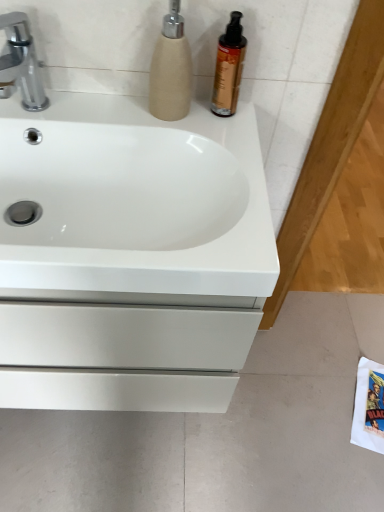
Find the location of a particular element. The width and height of the screenshot is (384, 512). shiny amber bottle at upper right is located at coordinates (229, 68).

Where is `silver metallic faucet at upper left`? This screenshot has height=512, width=384. silver metallic faucet at upper left is located at coordinates (21, 63).

Considering the sizes of objects shiny amber bottle at upper right and beige textured soap dispenser at upper center in the image provided, who is taller, shiny amber bottle at upper right or beige textured soap dispenser at upper center?

beige textured soap dispenser at upper center.

Based on the photo, from a real-world perspective, which is physically below, shiny amber bottle at upper right or beige textured soap dispenser at upper center?

shiny amber bottle at upper right, from a real-world perspective.

Identify the location of soap dispenser above the shiny amber bottle at upper right (from the image's perspective). The image size is (384, 512). (171, 69).

Can you see silver metallic faucet at upper left touching white matte drawer at lower left?

silver metallic faucet at upper left is not next to white matte drawer at lower left, and they're not touching.

In terms of width, does silver metallic faucet at upper left look wider or thinner when compared to white matte drawer at lower left?

Clearly, silver metallic faucet at upper left has less width compared to white matte drawer at lower left.

From a real-world perspective, which is physically below, silver metallic faucet at upper left or white matte drawer at lower left?

white matte drawer at lower left.

Considering the positions of objects silver metallic faucet at upper left and white matte drawer at lower left in the image provided, who is in front, silver metallic faucet at upper left or white matte drawer at lower left?

Positioned in front is silver metallic faucet at upper left.

Does point (166, 55) appear closer or farther from the camera than point (25, 36)?

Point (166, 55).

How many degrees apart are the facing directions of beige textured soap dispenser at upper center and silver metallic faucet at upper left?

They differ by 3.16e-05 degrees in their facing directions.

Would you consider beige textured soap dispenser at upper center to be distant from silver metallic faucet at upper left?

No, there isn't a large distance between beige textured soap dispenser at upper center and silver metallic faucet at upper left.

Is beige textured soap dispenser at upper center bigger than silver metallic faucet at upper left?

No, beige textured soap dispenser at upper center is not bigger than silver metallic faucet at upper left.

From a real-world perspective, is white glossy sink at center above or below white matte drawer at lower left?

Clearly, from a real-world perspective, white glossy sink at center is above white matte drawer at lower left.

In terms of width, does white glossy sink at center look wider or thinner when compared to white matte drawer at lower left?

Considering their sizes, white glossy sink at center looks slimmer than white matte drawer at lower left.

Is white glossy sink at center taller than white matte drawer at lower left?

Correct, white glossy sink at center is much taller as white matte drawer at lower left.

Which of these two, white matte drawer at lower left or shiny amber bottle at upper right, is bigger?

Bigger between the two is white matte drawer at lower left.

From a real-world perspective, between white matte drawer at lower left and shiny amber bottle at upper right, who is vertically higher?

In real-world perspective, shiny amber bottle at upper right is above.

Would you say white matte drawer at lower left is a long distance from shiny amber bottle at upper right?

No, white matte drawer at lower left is not far away from shiny amber bottle at upper right.

Is white glossy sink at center closer to the viewer compared to shiny amber bottle at upper right?

Yes, it is.

From the image's perspective, between white glossy sink at center and shiny amber bottle at upper right, who is located below?

white glossy sink at center, from the image's perspective.

Looking at this image, could you tell me if white glossy sink at center is turned towards shiny amber bottle at upper right?

No.

From the picture: Is white glossy sink at center shorter than shiny amber bottle at upper right?

Yes, white glossy sink at center is shorter than shiny amber bottle at upper right.

Is beige textured soap dispenser at upper center surrounded by white glossy sink at center?

That's incorrect, beige textured soap dispenser at upper center is not inside white glossy sink at center.

Is white glossy sink at center wider than beige textured soap dispenser at upper center?

Yes.

Is white glossy sink at center looking in the opposite direction of beige textured soap dispenser at upper center?

No, beige textured soap dispenser at upper center is not at the back of white glossy sink at center.

Considering the relative sizes of white glossy sink at center and beige textured soap dispenser at upper center in the image provided, is white glossy sink at center smaller than beige textured soap dispenser at upper center?

Incorrect, white glossy sink at center is not smaller in size than beige textured soap dispenser at upper center.

Identify the location of soap dispenser lying in front of the shiny amber bottle at upper right. (171, 69).

The height and width of the screenshot is (512, 384). Find the location of `tap lying on the left of white matte drawer at lower left`. tap lying on the left of white matte drawer at lower left is located at coordinates (21, 63).

Which object lies further to the anchor point beige textured soap dispenser at upper center, white matte drawer at lower left or shiny amber bottle at upper right?

Among the two, white matte drawer at lower left is located further to beige textured soap dispenser at upper center.

Which object lies further to the anchor point white matte drawer at lower left, silver metallic faucet at upper left or white glossy sink at center?

silver metallic faucet at upper left lies further to white matte drawer at lower left than the other object.

Consider the image. When comparing their distances from white glossy sink at center, does silver metallic faucet at upper left or beige textured soap dispenser at upper center seem further?

silver metallic faucet at upper left is positioned further to the anchor white glossy sink at center.

Looking at the image, which one is located further to white glossy sink at center, shiny amber bottle at upper right or beige textured soap dispenser at upper center?

Among the two, shiny amber bottle at upper right is located further to white glossy sink at center.

Which object lies further to the anchor point white matte drawer at lower left, beige textured soap dispenser at upper center or silver metallic faucet at upper left?

The object further to white matte drawer at lower left is silver metallic faucet at upper left.

Based on the photo, estimate the real-world distances between objects in this image. Which object is further from white glossy sink at center, beige textured soap dispenser at upper center or shiny amber bottle at upper right?

shiny amber bottle at upper right is further to white glossy sink at center.

When comparing their distances from shiny amber bottle at upper right, does silver metallic faucet at upper left or beige textured soap dispenser at upper center seem further?

The object further to shiny amber bottle at upper right is silver metallic faucet at upper left.

Estimate the real-world distances between objects in this image. Which object is further from beige textured soap dispenser at upper center, shiny amber bottle at upper right or white glossy sink at center?

The object further to beige textured soap dispenser at upper center is white glossy sink at center.

The height and width of the screenshot is (512, 384). Identify the location of cleaning product that lies between beige textured soap dispenser at upper center and white matte drawer at lower left from top to bottom. (229, 68).

This screenshot has height=512, width=384. Find the location of `sink situated between silver metallic faucet at upper left and shiny amber bottle at upper right from left to right`. sink situated between silver metallic faucet at upper left and shiny amber bottle at upper right from left to right is located at coordinates (135, 200).

Locate an element on the screen. The image size is (384, 512). sink located between silver metallic faucet at upper left and beige textured soap dispenser at upper center in the left-right direction is located at coordinates (135, 200).

The height and width of the screenshot is (512, 384). Identify the location of cleaning product between beige textured soap dispenser at upper center and white glossy sink at center in the vertical direction. (229, 68).